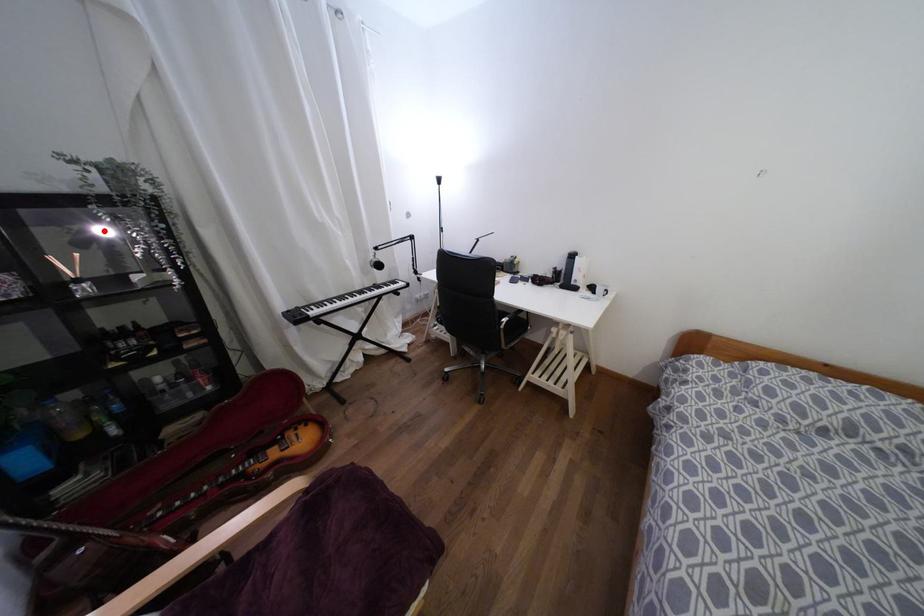
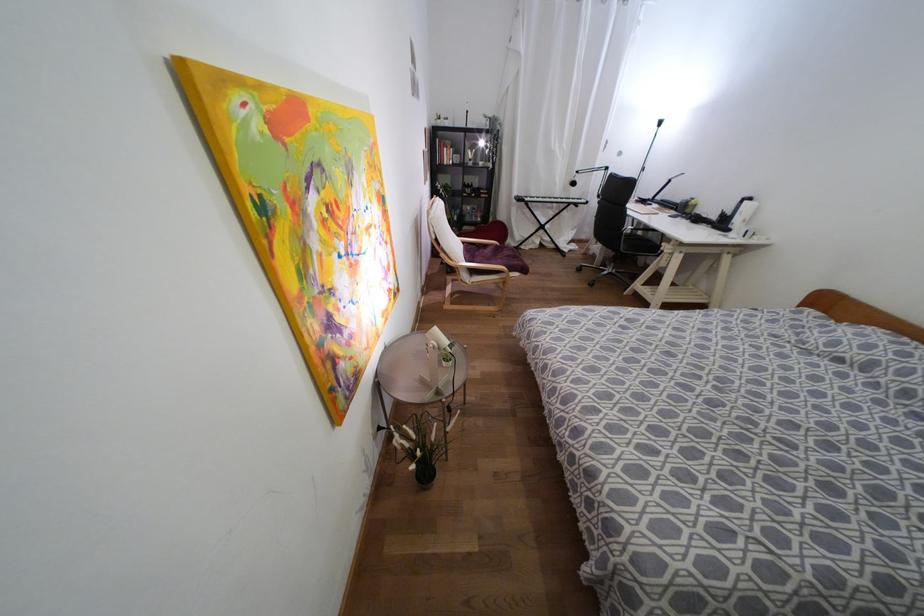
Locate, in the second image, the point that corresponds to the highlighted location in the first image.

(480, 143)